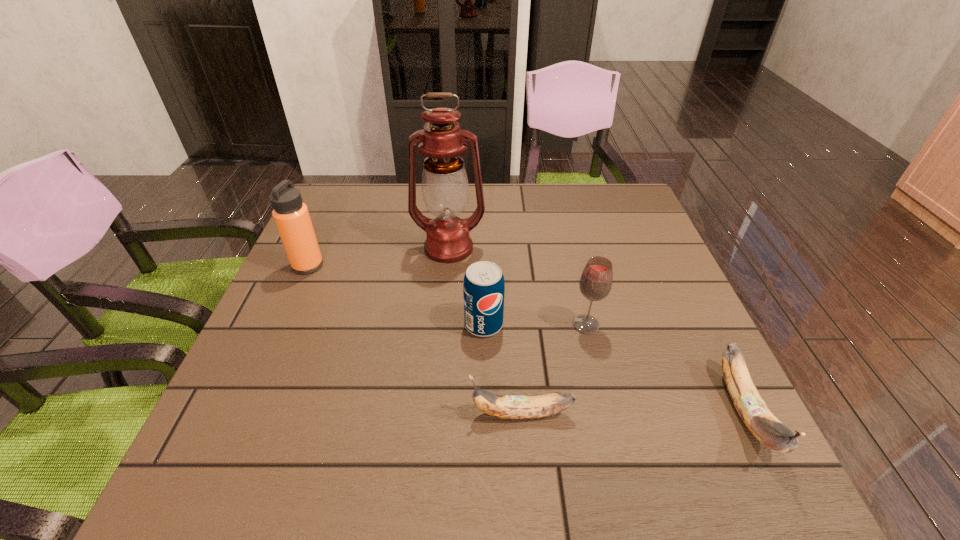
Where is `free point that keeps the bananas evenly spaced on the left`? The height and width of the screenshot is (540, 960). free point that keeps the bananas evenly spaced on the left is located at coordinates (297, 415).